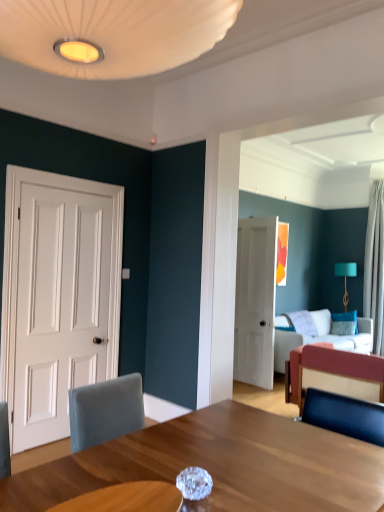
This screenshot has width=384, height=512. I want to click on white sheer curtain at right, so click(x=375, y=265).

The height and width of the screenshot is (512, 384). What do you see at coordinates (58, 297) in the screenshot?
I see `white matte door at left, which is counted as the 2th door, starting from the right` at bounding box center [58, 297].

Identify the location of teal fabric lampshade at upper right. (345, 277).

Find the location of a particular element. The height and width of the screenshot is (512, 384). white sheer curtain at right is located at coordinates (375, 265).

How much distance is there between velvet fabric couch at center and white matte door at left, which is counted as the 2th door, starting from the right?

They are 3.04 meters apart.

Based on the photo, can you confirm if velvet fabric couch at center is thinner than white matte door at left, placed as the 2th door when sorted from back to front?

In fact, velvet fabric couch at center might be wider than white matte door at left, placed as the 2th door when sorted from back to front.

Locate an element on the screen. door that is the 1st one above the velvet fabric couch at center (from a real-world perspective) is located at coordinates (58, 297).

In the image, is velvet fabric couch at center positioned in front of or behind white matte door at left, which ranks as the 1th door in front-to-back order?

Clearly, velvet fabric couch at center is behind white matte door at left, which ranks as the 1th door in front-to-back order.

Who is taller, white matte door at left, which ranks as the 1th door in front-to-back order, or velvet red couch at right?

white matte door at left, which ranks as the 1th door in front-to-back order.

Based on the photo, which of these two, white matte door at left, the 1th door viewed from the left, or velvet red couch at right, is smaller?

With smaller size is white matte door at left, the 1th door viewed from the left.

Are white matte door at left, the 1th door viewed from the left, and velvet red couch at right beside each other?

No, white matte door at left, the 1th door viewed from the left, is not beside velvet red couch at right.

Which of these two, blue velvet pillow at upper right or teal fabric lampshade at upper right, is bigger?

teal fabric lampshade at upper right is bigger.

Is blue velvet pillow at upper right oriented towards teal fabric lampshade at upper right?

No.

Is blue velvet pillow at upper right next to teal fabric lampshade at upper right?

No.

Is blue velvet pillow at upper right wider than teal fabric lampshade at upper right?

In fact, blue velvet pillow at upper right might be narrower than teal fabric lampshade at upper right.

The width and height of the screenshot is (384, 512). What are the coordinates of `curtain that is above the blue velvet pillow at upper right (from the image's perspective)` in the screenshot? It's located at (375, 265).

From the picture: Which is less distant, (370, 223) or (349, 322)?

Point (370, 223) appears to be closer to the viewer than point (349, 322).

What's the angular difference between white sheer curtain at right and blue velvet pillow at upper right's facing directions?

white sheer curtain at right and blue velvet pillow at upper right are facing 13.7 degrees away from each other.

Could you tell me if white matte door at left, which ranks as the 1th door in front-to-back order, is turned towards velvet fabric couch at center?

No, white matte door at left, which ranks as the 1th door in front-to-back order, is not oriented towards velvet fabric couch at center.

Between white matte door at left, which is counted as the 2th door, starting from the right, and velvet fabric couch at center, which one has larger size?

Bigger between the two is velvet fabric couch at center.

The width and height of the screenshot is (384, 512). Identify the location of the 2nd door in front of the velvet fabric couch at center, counting from the anchor's position. 58,297.

Could you tell me if velvet fabric couch at center is turned towards teal fabric lampshade at upper right?

No, velvet fabric couch at center is not oriented towards teal fabric lampshade at upper right.

Is velvet fabric couch at center beside teal fabric lampshade at upper right?

No, velvet fabric couch at center is not in contact with teal fabric lampshade at upper right.

From a real-world perspective, which object stands above the other?

In real-world perspective, teal fabric lampshade at upper right is above.

In the scene shown: Which is farther, (326, 337) or (346, 274)?

The point (346, 274) is more distant.

Locate an element on the screen. pillow beneath the white matte door at center, the second door positioned from the front (from a real-world perspective) is located at coordinates (344, 323).

Measure the distance between blue velvet pillow at upper right and white matte door at center, the second door when ordered from left to right.

blue velvet pillow at upper right and white matte door at center, the second door when ordered from left to right, are 1.78 meters apart from each other.

Based on the photo, does blue velvet pillow at upper right have a larger size compared to white matte door at center, the second door when ordered from left to right?

Incorrect, blue velvet pillow at upper right is not larger than white matte door at center, the second door when ordered from left to right.

Is blue velvet pillow at upper right not inside white matte door at center, which is the 1th door from back to front?

That's correct, blue velvet pillow at upper right is outside of white matte door at center, which is the 1th door from back to front.

Locate an element on the screen. The width and height of the screenshot is (384, 512). the 2nd door in front of the velvet fabric couch at center, starting your count from the anchor is located at coordinates (58, 297).

I want to click on couch behind the white matte door at left, placed as the 2th door when sorted from back to front, so click(x=331, y=368).

Estimate the real-world distances between objects in this image. Which object is closer to blue velvet pillow at upper right, velvet red couch at right or velvet fabric couch at center?

velvet fabric couch at center lies closer to blue velvet pillow at upper right than the other object.

Which object lies nearer to the anchor point white sheer curtain at right, white matte door at center, marked as the first door in a right-to-left arrangement, or white matte door at left, placed as the 2th door when sorted from back to front?

white matte door at center, marked as the first door in a right-to-left arrangement, is closer to white sheer curtain at right.

Which object lies nearer to the anchor point teal fabric lampshade at upper right, white matte door at left, which is counted as the 2th door, starting from the right, or velvet fabric couch at center?

velvet fabric couch at center is positioned closer to the anchor teal fabric lampshade at upper right.

Considering their positions, is white matte door at center, which is the 1th door from back to front, positioned closer to blue velvet pillow at upper right than velvet fabric couch at center?

The object closer to blue velvet pillow at upper right is velvet fabric couch at center.

Considering their positions, is velvet fabric couch at center positioned closer to white sheer curtain at right than teal fabric lampshade at upper right?

Based on the image, velvet fabric couch at center appears to be nearer to white sheer curtain at right.

Estimate the real-world distances between objects in this image. Which object is closer to teal fabric lampshade at upper right, blue velvet pillow at upper right or velvet fabric couch at center?

The object closer to teal fabric lampshade at upper right is blue velvet pillow at upper right.

From the image, which object appears to be nearer to white matte door at center, the second door when ordered from left to right, teal fabric lampshade at upper right or blue velvet pillow at upper right?

blue velvet pillow at upper right.

Looking at this image, looking at the image, which one is located closer to white sheer curtain at right, velvet fabric couch at center or velvet red couch at right?

Based on the image, velvet fabric couch at center appears to be nearer to white sheer curtain at right.

The image size is (384, 512). I want to click on pillow located between white matte door at left, the 1th door viewed from the left, and white sheer curtain at right in the left-right direction, so tap(344, 323).

You are a GUI agent. You are given a task and a screenshot of the screen. Output one action in this format:
    pyautogui.click(x=<x>, y=<y>)
    Task: Click on the pillow between white matte door at left, placed as the 2th door when sorted from back to front, and teal fabric lampshade at upper right in the front-back direction
    This screenshot has width=384, height=512.
    Given the screenshot: What is the action you would take?
    pyautogui.click(x=344, y=323)

Identify the location of studio couch situated between white matte door at left, which ranks as the 1th door in front-to-back order, and blue velvet pillow at upper right from left to right. The image size is (384, 512). (319, 337).

Locate an element on the screen. door between velvet red couch at right and blue velvet pillow at upper right in the front-back direction is located at coordinates (255, 301).